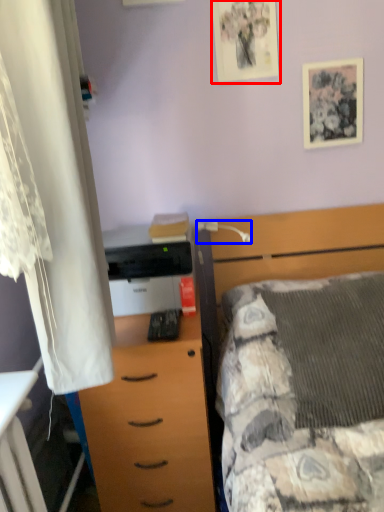
Question: Among these objects, which one is nearest to the camera, picture frame (highlighted by a red box) or lamp (highlighted by a blue box)?

Choices:
 (A) picture frame
 (B) lamp

Answer: (B)